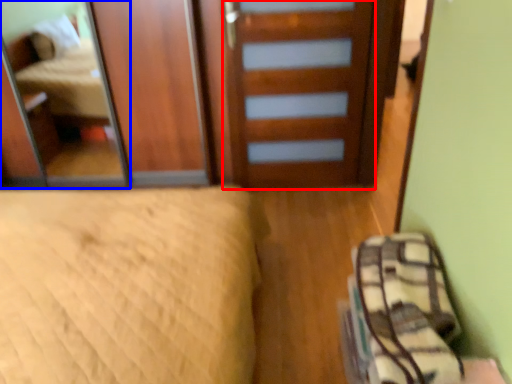
Question: Which object appears closest to the camera in this image, door (highlighted by a red box) or mirror (highlighted by a blue box)?

Choices:
 (A) door
 (B) mirror

Answer: (A)